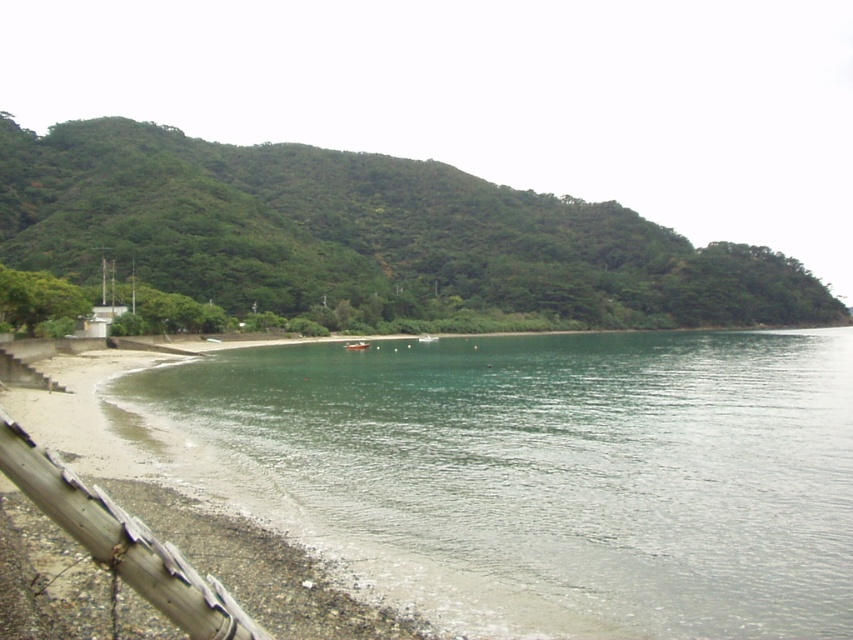
You are an artist sketching the coastal scene and want to place the green leafy hillside at upper left accurately. According to the coordinates provided, where should you position it on your drawing canvas?

The green leafy hillside at upper left should be positioned at coordinates point (364, 234) on your drawing canvas.